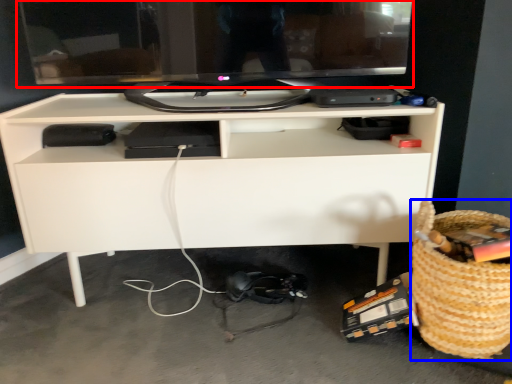
Question: Which point is further to the camera, computer monitor (highlighted by a red box) or basket (highlighted by a blue box)?

Choices:
 (A) computer monitor
 (B) basket

Answer: (A)